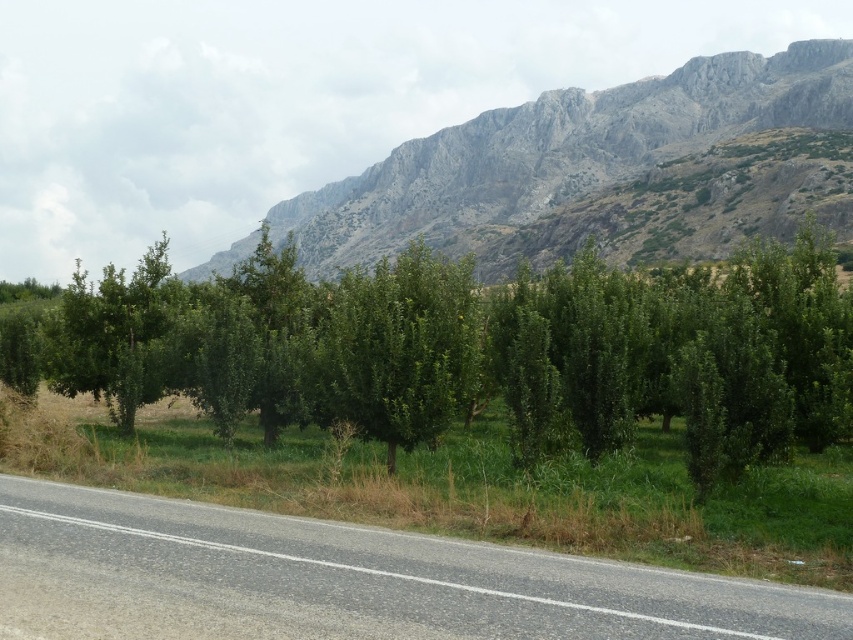
You are standing at the point marked as point (473, 349) in the image. Looking around, you see a green leafy tree at center. Can you tell me what is located exactly at the point you are standing on?

The point (473, 349) is where the green leafy tree at center is located.

You are standing on the road next to the green leafy tree at center and want to take a photo of the gray rocky mountain at upper center. Will the tree block your view of the mountain?

The green leafy tree at center is closer to the viewer than the gray rocky mountain at upper center, so the tree will block part of the mountain in your photo.

Looking at this image, you are a hiker planning to walk along the gray asphalt road at lower left and want to rest under the green leafy tree at center. Considering their sizes, which one do you think will provide more shade?

The green leafy tree at center has a larger size compared to gray asphalt road at lower left, so it will provide more shade.